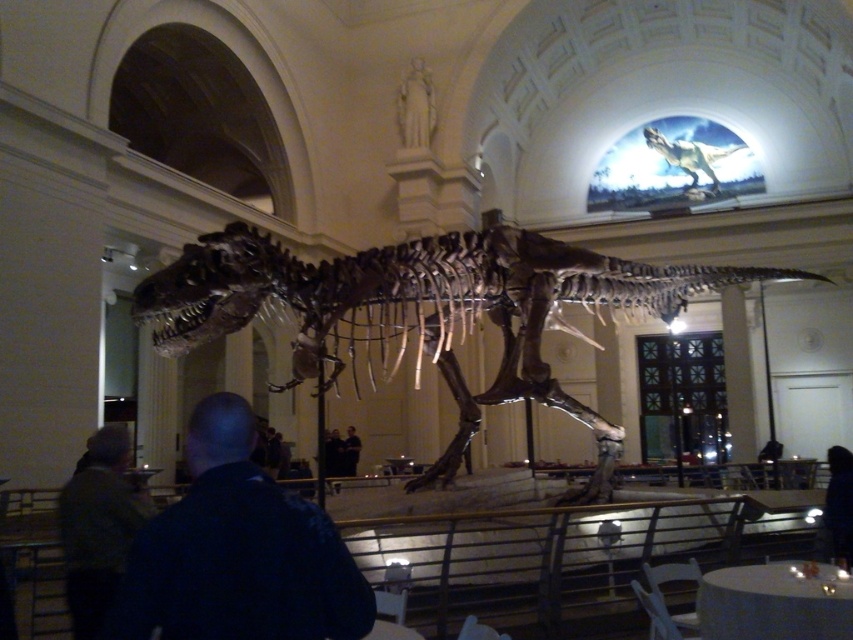
You are a visitor in the museum and want to take a photo of the shiny metallic skeleton at center. However, there is a person wearing a dark blue shirt at lower left blocking your view. Based on their positions, can you move to your left or right to get an unobstructed view?

Since the shiny metallic skeleton at center is to the right of dark blue shirt at lower left, you should move to your right to get an unobstructed view of the shiny metallic skeleton at center.

You are a visitor in the museum and want to take a photo of the shiny metallic skeleton at center without the dark brown leather jacket at lower left appearing in the frame. Is this possible based on their positions?

The shiny metallic skeleton at center is positioned on the right side of the dark brown leather jacket at lower left, so if you move to the right of the jacket, you can take a photo of the skeleton without the jacket in the frame.